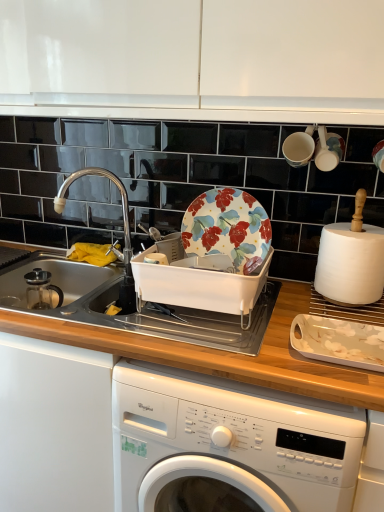
Question: Is white glossy cabinet at upper center not inside white matte paper towel at right?

Choices:
 (A) yes
 (B) no

Answer: (A)

Question: From the image's perspective, is white glossy cabinet at upper center under white matte paper towel at right?

Choices:
 (A) yes
 (B) no

Answer: (B)

Question: Is the position of white glossy cabinet at upper center more distant than that of white matte paper towel at right?

Choices:
 (A) no
 (B) yes

Answer: (A)

Question: Is white glossy cabinet at upper center oriented away from white matte paper towel at right?

Choices:
 (A) yes
 (B) no

Answer: (B)

Question: Is white glossy cabinet at upper center taller than white matte paper towel at right?

Choices:
 (A) yes
 (B) no

Answer: (A)

Question: Is white matte paper towel at right bigger or smaller than white glossy platter at lower right?

Choices:
 (A) small
 (B) big

Answer: (B)

Question: Looking at their shapes, would you say white matte paper towel at right is wider or thinner than white glossy platter at lower right?

Choices:
 (A) thin
 (B) wide

Answer: (A)

Question: From their relative heights in the image, would you say white matte paper towel at right is taller or shorter than white glossy platter at lower right?

Choices:
 (A) tall
 (B) short

Answer: (A)

Question: Does point (345, 240) appear closer or farther from the camera than point (350, 333)?

Choices:
 (A) farther
 (B) closer

Answer: (A)

Question: From a real-world perspective, is white glossy platter at lower right above or below white glossy washing machine at lower center?

Choices:
 (A) below
 (B) above

Answer: (B)

Question: From the image's perspective, is white glossy platter at lower right positioned above or below white glossy washing machine at lower center?

Choices:
 (A) below
 (B) above

Answer: (B)

Question: Is white glossy platter at lower right wider or thinner than white glossy washing machine at lower center?

Choices:
 (A) wide
 (B) thin

Answer: (B)

Question: Based on their sizes in the image, would you say white glossy platter at lower right is bigger or smaller than white glossy washing machine at lower center?

Choices:
 (A) small
 (B) big

Answer: (A)

Question: Would you say white glossy cabinet at upper center is inside or outside white glossy platter at lower right?

Choices:
 (A) inside
 (B) outside

Answer: (B)

Question: From a real-world perspective, is white glossy cabinet at upper center positioned above or below white glossy platter at lower right?

Choices:
 (A) below
 (B) above

Answer: (B)